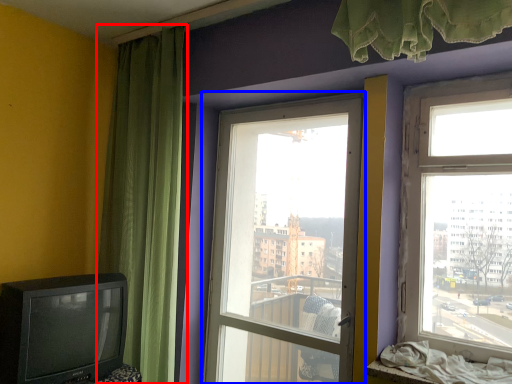
Question: Among these objects, which one is farthest to the camera, curtain (highlighted by a red box) or window (highlighted by a blue box)?

Choices:
 (A) curtain
 (B) window

Answer: (A)